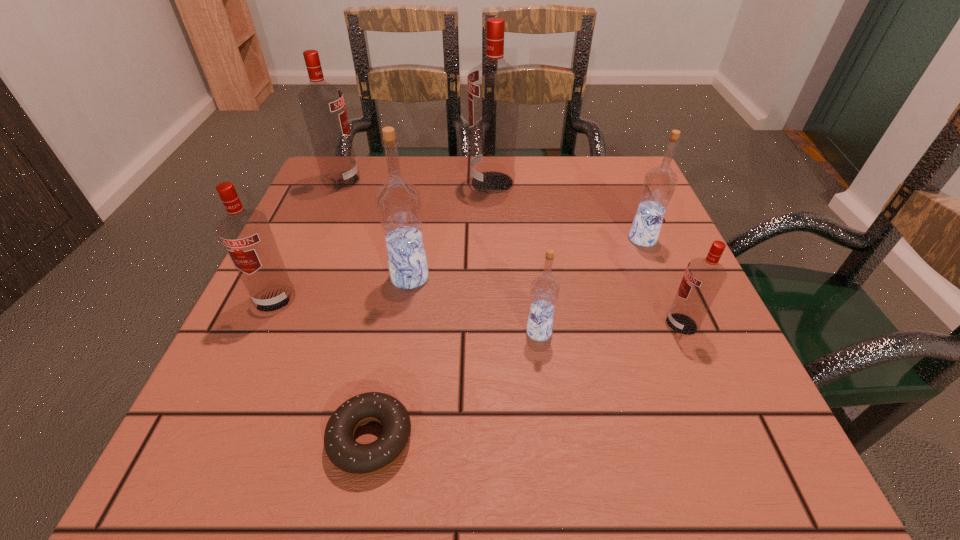
Find the location of a particular element. Image resolution: width=960 pixels, height=540 pixels. the smallest blue vodka is located at coordinates (544, 291).

Find the location of a particular element. brown doughnut is located at coordinates (345, 453).

Find the location of a particular element. The image size is (960, 540). the nearest object is located at coordinates (345, 453).

Find the location of a particular element. blank space located on the front label of the tallest vodka is located at coordinates (355, 183).

Identify the location of free spot located on the front label of the tallest vodka. (384, 183).

I want to click on blank area located on the front label of the tallest vodka, so click(x=384, y=183).

Find the location of a particular element. vacant area situated on the front label of the third smallest red vodka is located at coordinates (462, 181).

The height and width of the screenshot is (540, 960). Identify the location of blank space located 0.300m on the right of the fifth vodka from right to left. [587, 277].

Where is `free spot located on the back of the second smallest blue vodka`? This screenshot has height=540, width=960. free spot located on the back of the second smallest blue vodka is located at coordinates (625, 196).

Locate an element on the screen. This screenshot has height=540, width=960. vacant region located on the front label of the second smallest red vodka is located at coordinates (214, 433).